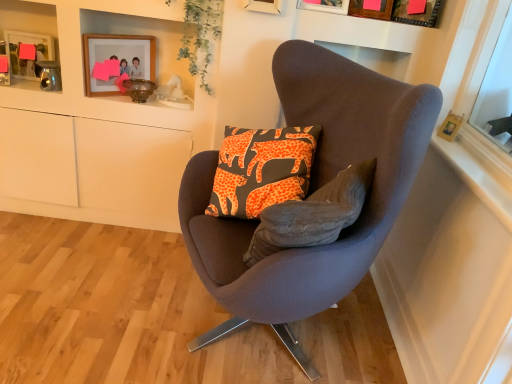
Question: From a real-world perspective, is brushed metal picture frame at upper left, acting as the first picture frame starting from the left, positioned above or below green leafy plant at upper center?

Choices:
 (A) above
 (B) below

Answer: (B)

Question: Would you say brushed metal picture frame at upper left, which appears as the fifth picture frame when viewed from the right, is to the left or to the right of green leafy plant at upper center in the picture?

Choices:
 (A) left
 (B) right

Answer: (A)

Question: Based on their relative distances, which object is farther from the wooden picture frame at upper right, which is the 1th picture frame from right to left?

Choices:
 (A) wooden picture frame at upper center, the 4th picture frame positioned from the left
 (B) wooden frame at upper right
 (C) suede-like brown chair at center
 (D) green leafy plant at upper center
 (E) brushed metal picture frame at upper left, which appears as the fifth picture frame when viewed from the right

Answer: (E)

Question: Estimate the real-world distances between objects in this image. Which object is closer to the wooden picture frame at upper right, which is the 1th picture frame from right to left?

Choices:
 (A) wooden frame at upper right
 (B) suede-like brown chair at center
 (C) matte wooden picture frame at upper center, the 4th picture frame when ordered from right to left
 (D) green leafy plant at upper center
 (E) wooden picture frame at upper center, positioned as the 2th picture frame in right-to-left order

Answer: (E)